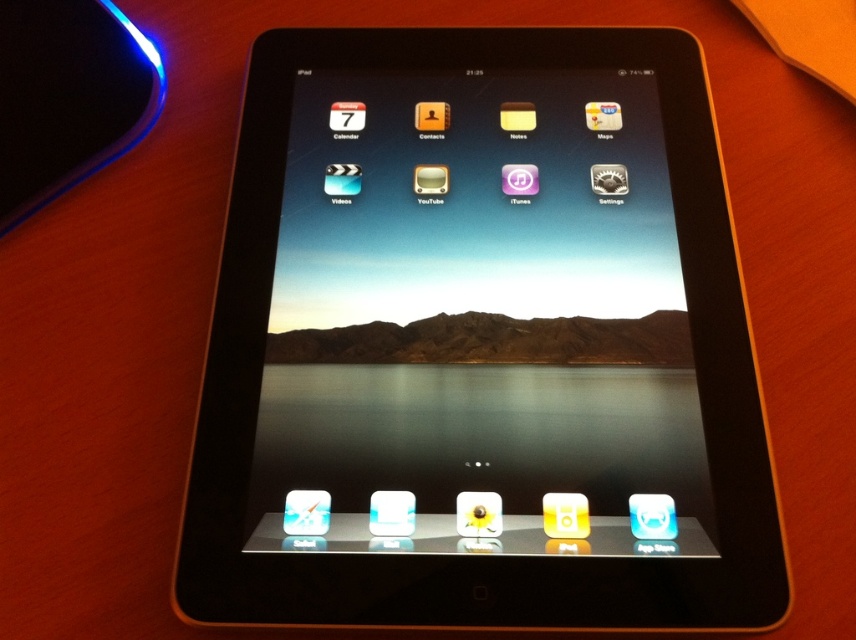
You are trying to place both the black glossy tablet at center and the matte white ipod at center vertically on a narrow shelf that can only accommodate items up to 12 inches in height. Given their height difference, which item might not fit and why?

The black glossy tablet at center is much taller than the matte white ipod at center, so the black glossy tablet at center might not fit on the shelf if its height exceeds 12 inches.

You are trying to place both the black glossy tablet at center and the matte white ipod at center into a storage case that can only fit one of them. Based on their widths, which one should you choose to ensure it fits?

The black glossy tablet at center might be wider than matte white ipod at center, so you should choose the matte white ipod at center to ensure it fits in the storage case.

You are setting up a display for a tech store and need to arrange the black glossy tablet at center and the matte white ipod at center on a shelf. According to the scene, which item should be placed on the left side of the shelf to ensure proper visibility?

The black glossy tablet at center is larger in size than the matte white ipod at center, so placing the larger tablet on the left side would ensure proper visibility as it can be seen more clearly from the left side of the shelf.